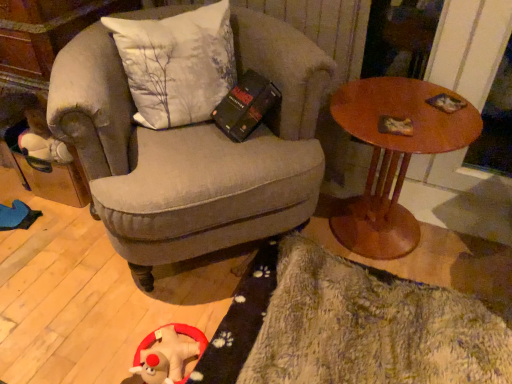
Describe the element at coordinates (349, 326) in the screenshot. I see `fluffy beige rug at lower right` at that location.

Locate an element on the screen. This screenshot has height=384, width=512. wooden round table at right is located at coordinates [x=393, y=157].

This screenshot has height=384, width=512. What do you see at coordinates (167, 354) in the screenshot? I see `fuzzy plush toy at lower left` at bounding box center [167, 354].

Where is `white fabric pillow at upper left`? This screenshot has height=384, width=512. white fabric pillow at upper left is located at coordinates (177, 64).

Is point (178, 109) closer or farther from the camera than point (272, 146)?

Point (178, 109) appears to be farther away from the viewer than point (272, 146).

Does white fabric pillow at upper left have a lesser width compared to textured gray armchair at center?

Yes.

Can you tell me how much white fabric pillow at upper left and textured gray armchair at center differ in facing direction?

The angle between the facing direction of white fabric pillow at upper left and the facing direction of textured gray armchair at center is 7.26 degrees.

From a real-world perspective, between white fabric pillow at upper left and textured gray armchair at center, who is vertically lower?

textured gray armchair at center, from a real-world perspective.

Does fluffy beige rug at lower right have a smaller size compared to wooden round table at right?

Indeed, fluffy beige rug at lower right has a smaller size compared to wooden round table at right.

Based on the photo, which of these two, fluffy beige rug at lower right or wooden round table at right, is wider?

With larger width is fluffy beige rug at lower right.

From a real-world perspective, which object rests below the other?

In real-world perspective, fluffy beige rug at lower right is lower.

Is textured gray armchair at center touching fluffy beige rug at lower right?

No, textured gray armchair at center is not making contact with fluffy beige rug at lower right.

From the image's perspective, between textured gray armchair at center and fluffy beige rug at lower right, who is located below?

fluffy beige rug at lower right is shown below in the image.

Considering the positions of points (100, 168) and (484, 341), is point (100, 168) closer to camera compared to point (484, 341)?

Yes, point (100, 168) is closer to viewer.

Considering the relative positions of fuzzy plush toy at lower left and wooden round table at right in the image provided, is fuzzy plush toy at lower left to the left of wooden round table at right from the viewer's perspective?

Correct, you'll find fuzzy plush toy at lower left to the left of wooden round table at right.

Which of these two, fuzzy plush toy at lower left or wooden round table at right, stands shorter?

fuzzy plush toy at lower left is shorter.

Who is bigger, fuzzy plush toy at lower left or wooden round table at right?

wooden round table at right is bigger.

Is fuzzy plush toy at lower left further to the viewer compared to wooden round table at right?

No.

Based on their positions, is wooden round table at right located to the left or right of white fabric pillow at upper left?

wooden round table at right is positioned on white fabric pillow at upper left's right side.

Can you confirm if wooden round table at right is smaller than white fabric pillow at upper left?

No.

Between wooden round table at right and white fabric pillow at upper left, which one has more height?

Standing taller between the two is wooden round table at right.

Are wooden round table at right and white fabric pillow at upper left far apart?

They are positioned close to each other.

Is white fabric pillow at upper left spatially inside fluffy beige rug at lower right, or outside of it?

white fabric pillow at upper left is spatially situated outside fluffy beige rug at lower right.

Does white fabric pillow at upper left have a lesser height compared to fluffy beige rug at lower right?

No, white fabric pillow at upper left is not shorter than fluffy beige rug at lower right.

Is white fabric pillow at upper left oriented away from fluffy beige rug at lower right?

white fabric pillow at upper left is not turned away from fluffy beige rug at lower right.

You are a GUI agent. You are given a task and a screenshot of the screen. Output one action in this format:
    pyautogui.click(x=<x>, y=<y>)
    Task: Click on the mat below the white fabric pillow at upper left (from a real-world perspective)
    This screenshot has height=384, width=512.
    Given the screenshot: What is the action you would take?
    pyautogui.click(x=349, y=326)

Looking at this image, measure the distance between white fabric pillow at upper left and fuzzy plush toy at lower left.

white fabric pillow at upper left and fuzzy plush toy at lower left are 29.94 inches apart.

Can fuzzy plush toy at lower left be found inside white fabric pillow at upper left?

Actually, fuzzy plush toy at lower left is outside white fabric pillow at upper left.

Based on the photo, considering the relative positions of white fabric pillow at upper left and fuzzy plush toy at lower left in the image provided, is white fabric pillow at upper left in front of fuzzy plush toy at lower left?

Yes, it is.

Considering the positions of objects white fabric pillow at upper left and fuzzy plush toy at lower left in the image provided, who is more to the left, white fabric pillow at upper left or fuzzy plush toy at lower left?

Positioned to the left is fuzzy plush toy at lower left.

I want to click on chair below the white fabric pillow at upper left (from a real-world perspective), so click(193, 149).

Identify the location of table behind the fluffy beige rug at lower right. (393, 157).

From the image, which object appears to be farther from fuzzy plush toy at lower left, wooden round table at right or fluffy beige rug at lower right?

Among the two, wooden round table at right is located further to fuzzy plush toy at lower left.

Which object lies nearer to the anchor point wooden round table at right, textured gray armchair at center or fluffy beige rug at lower right?

textured gray armchair at center lies closer to wooden round table at right than the other object.

Estimate the real-world distances between objects in this image. Which object is closer to white fabric pillow at upper left, fuzzy plush toy at lower left or wooden round table at right?

The object closer to white fabric pillow at upper left is wooden round table at right.

Which object lies further to the anchor point white fabric pillow at upper left, fuzzy plush toy at lower left or textured gray armchair at center?

fuzzy plush toy at lower left is further to white fabric pillow at upper left.

Considering their positions, is white fabric pillow at upper left positioned further to fuzzy plush toy at lower left than textured gray armchair at center?

Among the two, white fabric pillow at upper left is located further to fuzzy plush toy at lower left.

Considering their positions, is fluffy beige rug at lower right positioned closer to wooden round table at right than white fabric pillow at upper left?

The object closer to wooden round table at right is fluffy beige rug at lower right.

Looking at the image, which one is located further to fluffy beige rug at lower right, wooden round table at right or fuzzy plush toy at lower left?

Based on the image, wooden round table at right appears to be further to fluffy beige rug at lower right.

Looking at the image, which one is located closer to fluffy beige rug at lower right, textured gray armchair at center or fuzzy plush toy at lower left?

fuzzy plush toy at lower left is closer to fluffy beige rug at lower right.

Locate an element on the screen. table that lies between white fabric pillow at upper left and fuzzy plush toy at lower left from top to bottom is located at coordinates (393, 157).

You are a GUI agent. You are given a task and a screenshot of the screen. Output one action in this format:
    pyautogui.click(x=<x>, y=<y>)
    Task: Click on the mat between white fabric pillow at upper left and fuzzy plush toy at lower left in the up-down direction
    
    Given the screenshot: What is the action you would take?
    pyautogui.click(x=349, y=326)

Where is `mat between textured gray armchair at center and fuzzy plush toy at lower left vertically`? mat between textured gray armchair at center and fuzzy plush toy at lower left vertically is located at coordinates (349, 326).

Identify the location of mat between fuzzy plush toy at lower left and wooden round table at right in the horizontal direction. The height and width of the screenshot is (384, 512). (349, 326).